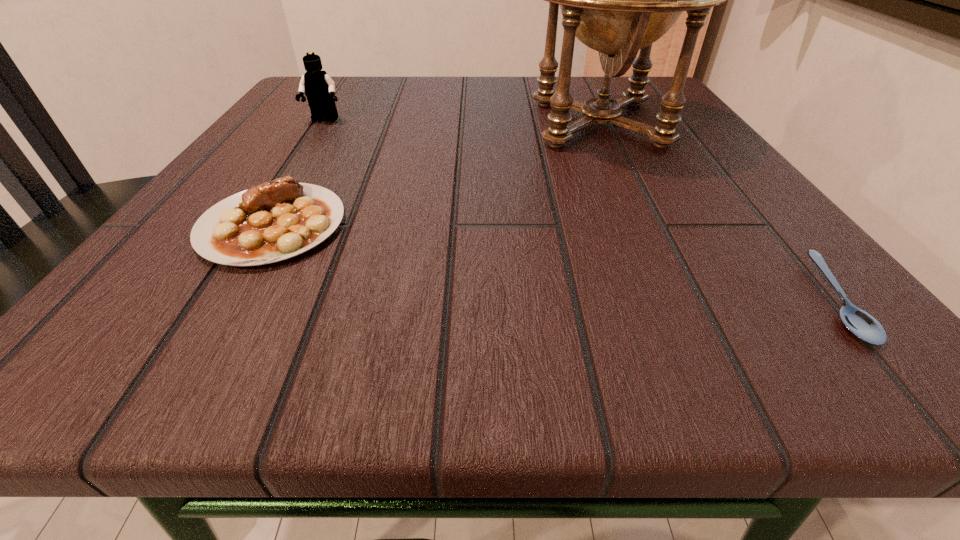
Locate an element on the screen. This screenshot has height=540, width=960. globe that is at the far edge is located at coordinates (617, 0).

Find the location of a particular element. The image size is (960, 540). Lego positioned at the far edge is located at coordinates (319, 88).

Identify the location of object that is at the near edge. click(x=863, y=325).

Identify the location of Lego that is at the left edge. (319, 88).

Locate an element on the screen. The image size is (960, 540). steak situated at the left edge is located at coordinates (272, 221).

Where is `globe that is at the right edge`? The image size is (960, 540). globe that is at the right edge is located at coordinates (617, 0).

Locate an element on the screen. soupspoon that is at the right edge is located at coordinates (863, 325).

Image resolution: width=960 pixels, height=540 pixels. I want to click on object at the far left corner, so click(319, 88).

Find the location of a particular element. This screenshot has width=960, height=540. object positioned at the far right corner is located at coordinates (617, 0).

Locate an element on the screen. Image resolution: width=960 pixels, height=540 pixels. object that is at the near right corner is located at coordinates (863, 325).